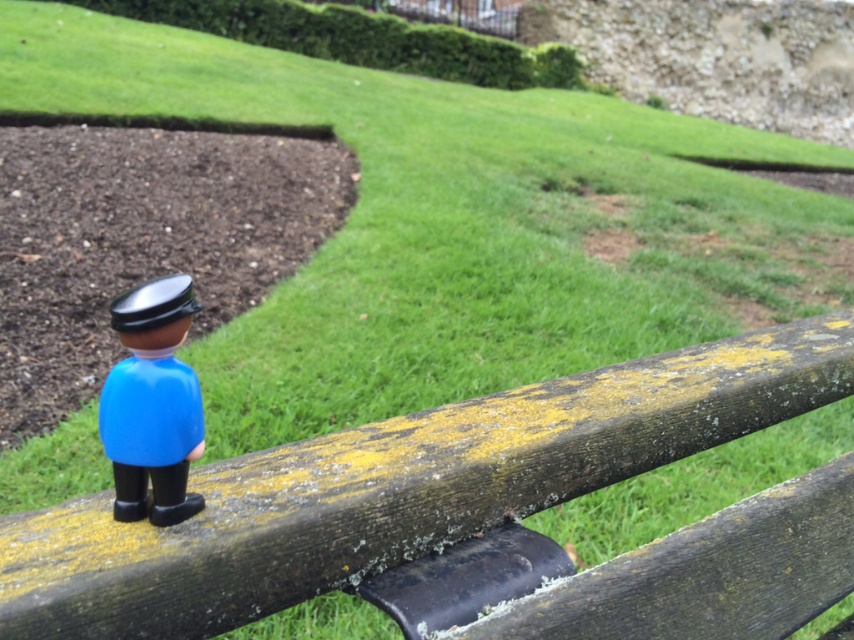
Can you confirm if wooden fence at center is wider than blue plastic figurine at lower left?

Correct, the width of wooden fence at center exceeds that of blue plastic figurine at lower left.

Looking at this image, who is shorter, wooden fence at center or blue plastic figurine at lower left?

blue plastic figurine at lower left

The image size is (854, 640). In order to click on wooden fence at center in this screenshot , I will do `click(402, 484)`.